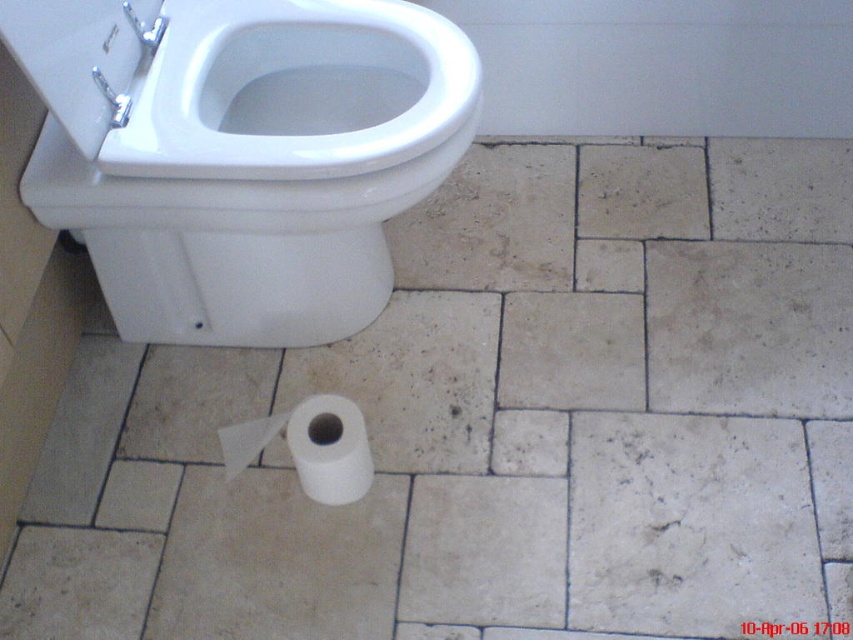
Looking at this image, you are a cleaning robot with a width of 14 inches. You need to move from the white glossy toilet bowl at upper left to the white matte toilet paper at lower center. Can you fit through the space between them?

The distance between the white glossy toilet bowl at upper left and the white matte toilet paper at lower center is 14.46 inches. Since the robot is 14 inches wide, it can fit through the space as there is enough clearance.

You are standing in the bathroom and want to reach the white glossy toilet bowl at upper left from the white matte toilet paper at lower center. Which direction should you move?

You should move to the left to reach the white glossy toilet bowl at upper left from the white matte toilet paper at lower center, since it is located to the left of the toilet paper.

You are a bathroom cleaner who needs to reach the white glossy toilet bowl at upper left and the white matte toilet paper at lower center. Which object is located higher up in the image?

The white glossy toilet bowl at upper left is above the white matte toilet paper at lower center, so it is higher up in the image.